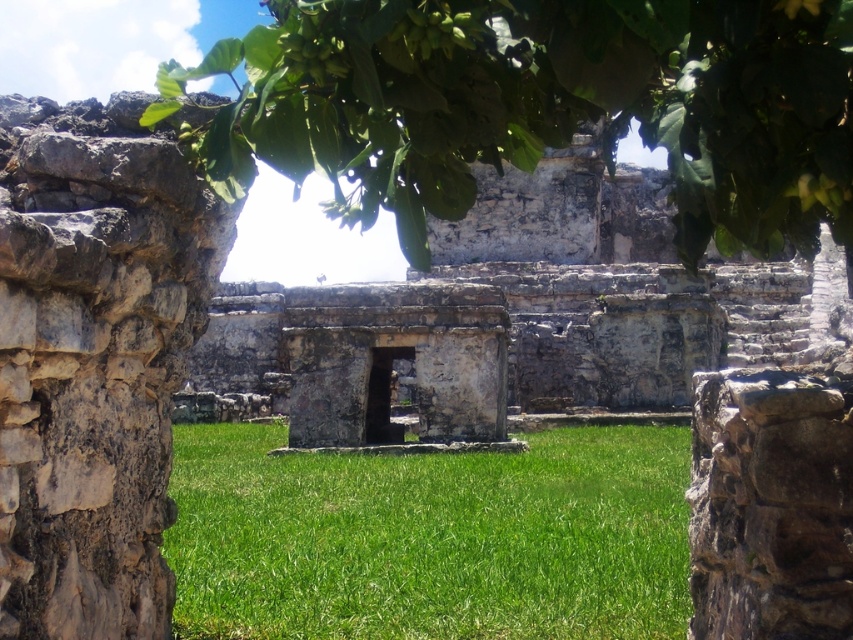
Looking at this image, you are standing at the base of the ancient stone structure and want to take a photo of the green leafy tree at upper center. If your camera has a zoom lens that can focus on objects at a specific coordinate, what coordinate should you aim for?

You should aim your camera at the coordinate point (541, 106) to focus on the green leafy tree at upper center.

You are standing on the green grass at center and want to walk towards the green leafy tree at upper center. Which direction should you head?

You should head to the right because the green leafy tree at upper center is located to the right of the green grass at center.